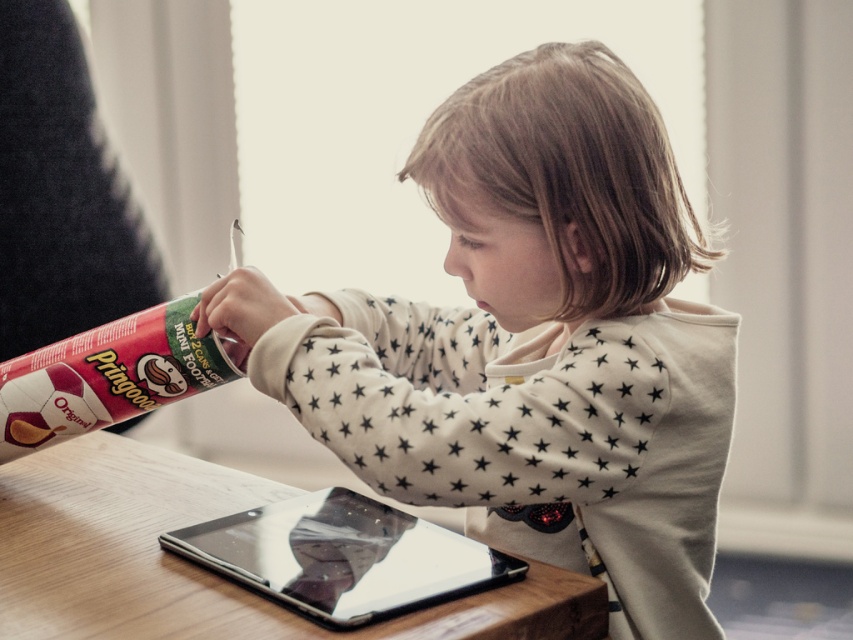
Can you confirm if white star-patterned sweater at center is positioned to the right of transparent plastic tablet at center?

Indeed, white star-patterned sweater at center is positioned on the right side of transparent plastic tablet at center.

In the scene shown: Measure the distance from white star-patterned sweater at center to transparent plastic tablet at center.

white star-patterned sweater at center and transparent plastic tablet at center are 7.66 inches apart.

Does point (386, 348) come behind point (425, 604)?

That is True.

Where is `white star-patterned sweater at center`? The height and width of the screenshot is (640, 853). white star-patterned sweater at center is located at coordinates (532, 342).

This screenshot has width=853, height=640. I want to click on white star-patterned sweater at center, so click(532, 342).

Who is positioned more to the right, white star-patterned sweater at center or wooden table at center?

white star-patterned sweater at center is more to the right.

The image size is (853, 640). Describe the element at coordinates (532, 342) in the screenshot. I see `white star-patterned sweater at center` at that location.

The image size is (853, 640). In order to click on white star-patterned sweater at center in this screenshot , I will do `click(532, 342)`.

Is wooden table at center shorter than transparent plastic tablet at center?

No, wooden table at center is not shorter than transparent plastic tablet at center.

Between wooden table at center and transparent plastic tablet at center, which one has more height?

wooden table at center is taller.

Does point (151, 452) come farther from viewer compared to point (392, 600)?

Yes, it is.

At what (x,y) coordinates should I click in order to perform the action: click on wooden table at center. Please return your answer as a coordinate pair (x, y). This screenshot has height=640, width=853. Looking at the image, I should click on (195, 564).